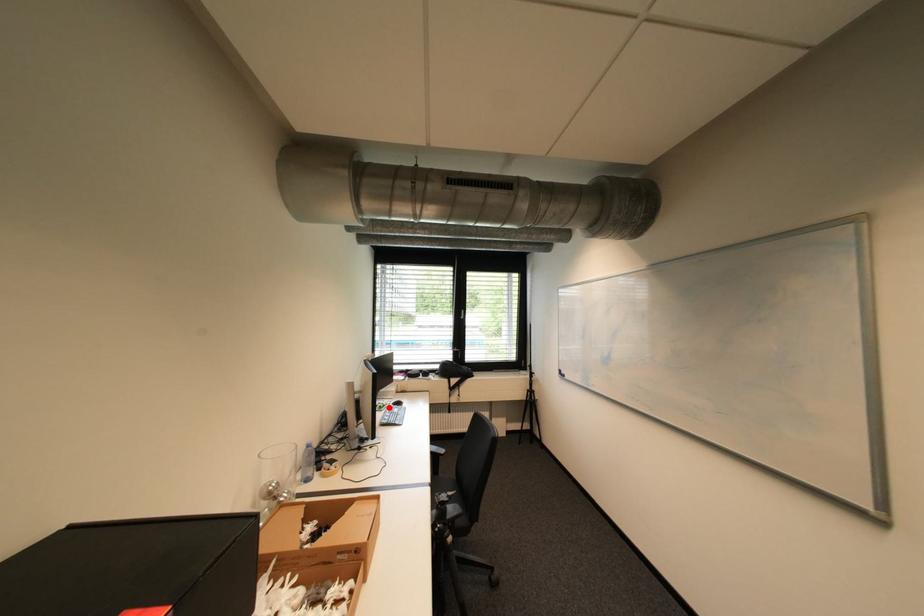
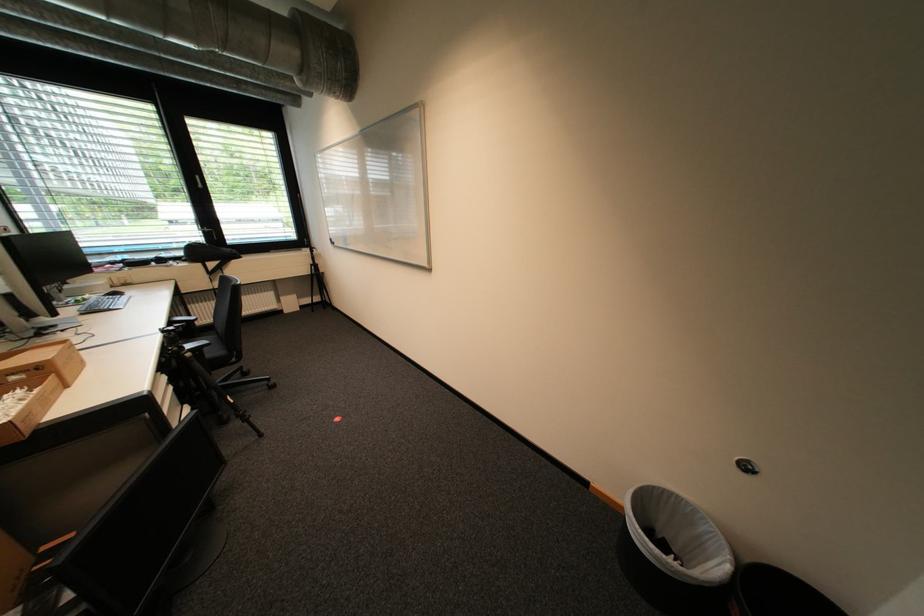
Find the pixel in the second image that matches the highlighted location in the first image.

(86, 302)